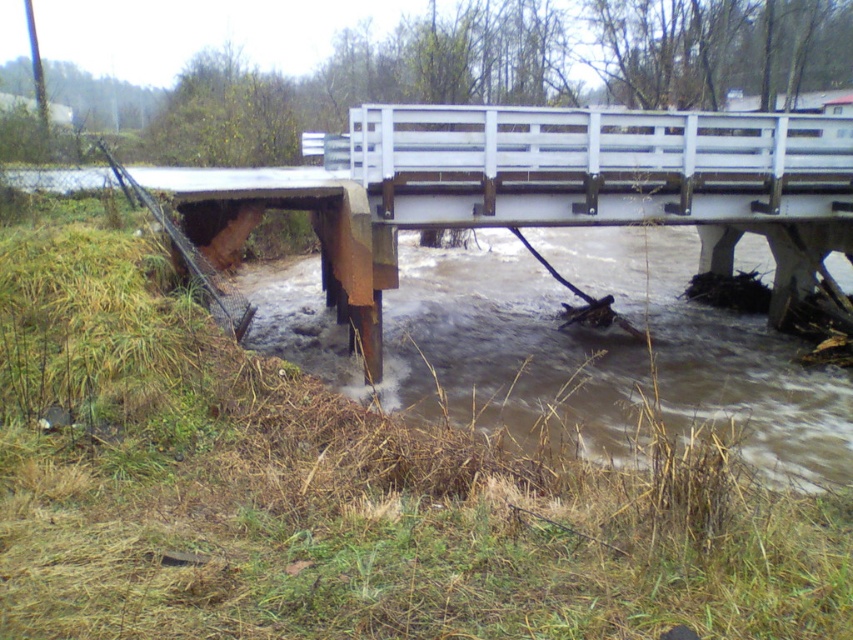
Question: Is rusty metal bridge at left smaller than brown muddy water at lower center?

Choices:
 (A) yes
 (B) no

Answer: (B)

Question: Considering the relative positions of rusty metal bridge at left and brown muddy water at lower center in the image provided, where is rusty metal bridge at left located with respect to brown muddy water at lower center?

Choices:
 (A) right
 (B) left

Answer: (B)

Question: Which point is closer to the camera?

Choices:
 (A) (405, 182)
 (B) (703, 387)

Answer: (A)

Question: In this image, where is rusty metal bridge at left located relative to brown muddy water at lower center?

Choices:
 (A) below
 (B) above

Answer: (B)